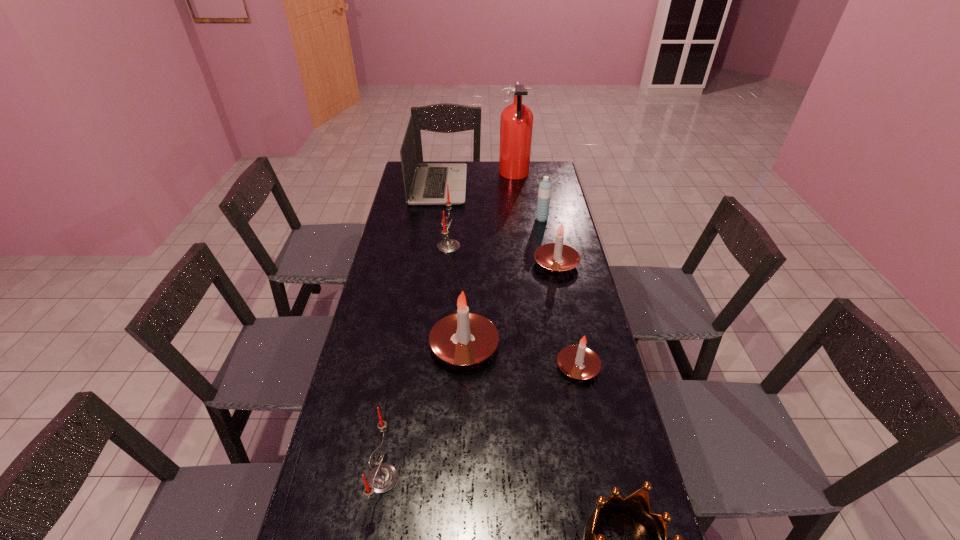
Select which white candle is the closest to the nearest candle. Please provide its 2D coordinates. Your answer should be formatted as a tuple, i.e. [(x, y)], where the tuple contains the x and y coordinates of a point satisfying the conditions above.

[(463, 338)]

Locate an element on the screen. red candle that stands as the second closest to the second biggest white candle is located at coordinates (382, 478).

Locate which red candle is the second closest to the tallest object. Please provide its 2D coordinates. Your answer should be formatted as a tuple, i.e. [(x, y)], where the tuple contains the x and y coordinates of a point satisfying the conditions above.

[(382, 478)]

Where is `vacant position in the image that satisfies the following two spatial constraints: 1. on the screen of the second tallest object; 2. on the left side of the seventh nearest object`? The width and height of the screenshot is (960, 540). vacant position in the image that satisfies the following two spatial constraints: 1. on the screen of the second tallest object; 2. on the left side of the seventh nearest object is located at coordinates (434, 219).

You are a GUI agent. You are given a task and a screenshot of the screen. Output one action in this format:
    pyautogui.click(x=<x>, y=<y>)
    Task: Click on the free space that satisfies the following two spatial constraints: 1. on the front-facing side of the bigger red candle; 2. on the right side of the farthest white candle
    
    Given the screenshot: What is the action you would take?
    pyautogui.click(x=447, y=263)

Locate an element on the screen. The width and height of the screenshot is (960, 540). free spot that satisfies the following two spatial constraints: 1. on the screen of the farthest white candle; 2. on the left side of the second tallest object is located at coordinates (427, 263).

At what (x,y) coordinates should I click in order to perform the action: click on free spot that satisfies the following two spatial constraints: 1. on the back side of the shortest candle; 2. on the front-facing side of the bigger red candle. Please return your answer as a coordinate pair (x, y). The image size is (960, 540). Looking at the image, I should click on (553, 246).